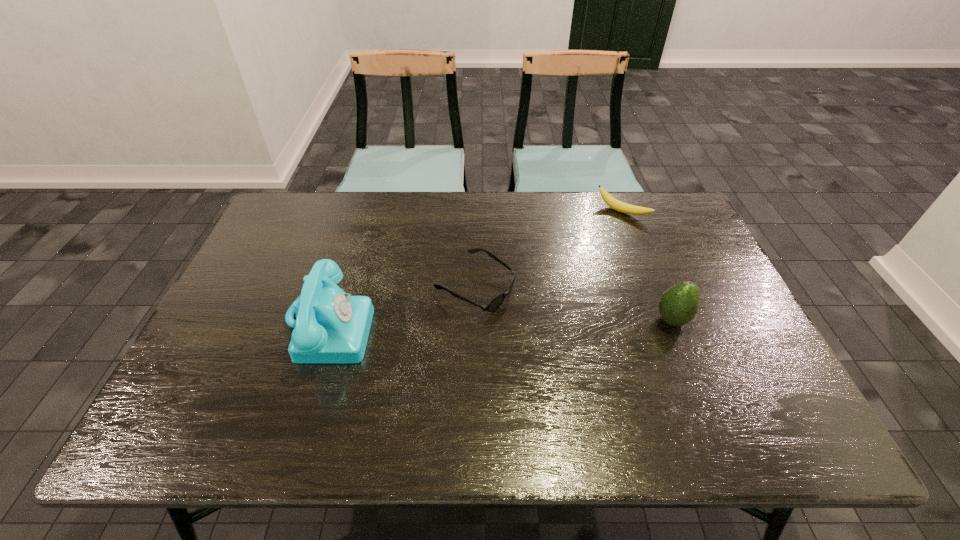
Where is `free location that satisfies the following two spatial constraints: 1. on the front side of the avocado; 2. on the right side of the second object from left to right`? This screenshot has height=540, width=960. free location that satisfies the following two spatial constraints: 1. on the front side of the avocado; 2. on the right side of the second object from left to right is located at coordinates (475, 320).